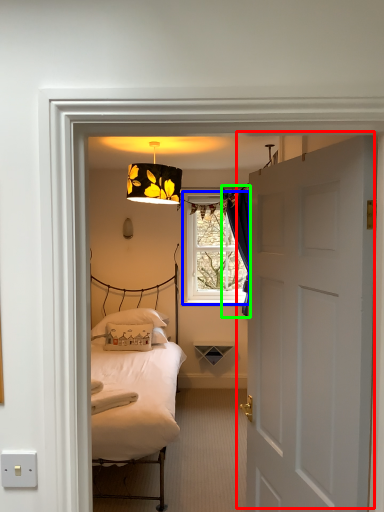
Question: Considering the real-world distances, which object is farthest from door (highlighted by a red box)? window (highlighted by a blue box) or curtain (highlighted by a green box)?

Choices:
 (A) window
 (B) curtain

Answer: (A)